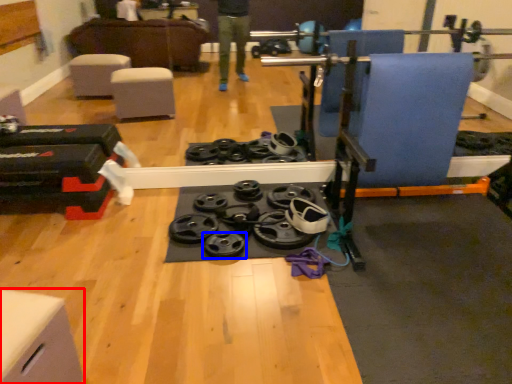
Question: Among these objects, which one is farthest to the camera, furniture (highlighted by a red box) or wheel (highlighted by a blue box)?

Choices:
 (A) furniture
 (B) wheel

Answer: (B)